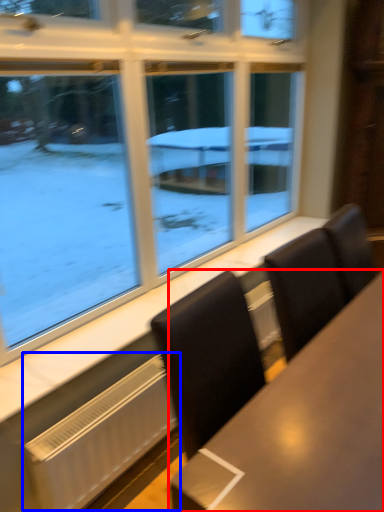
Question: Which object is further to the camera taking this photo, table (highlighted by a red box) or radiator (highlighted by a blue box)?

Choices:
 (A) table
 (B) radiator

Answer: (B)